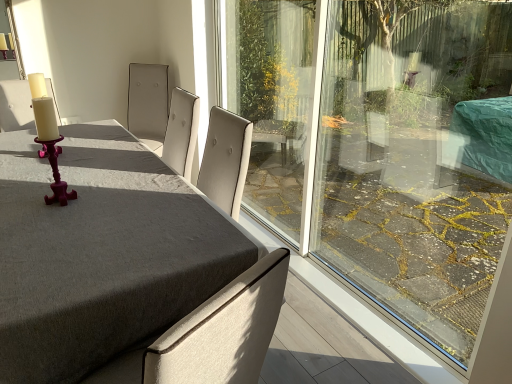
The width and height of the screenshot is (512, 384). In order to click on free point in front of matte purple candlestick at left in this screenshot , I will do `click(38, 218)`.